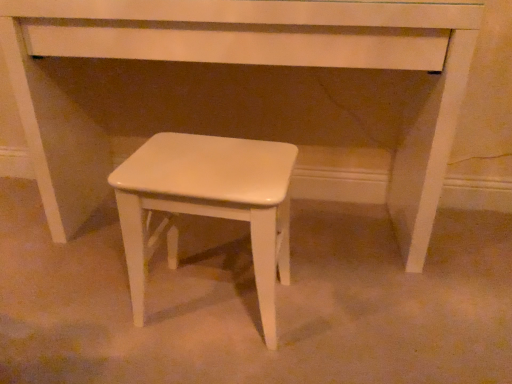
The width and height of the screenshot is (512, 384). Describe the element at coordinates (245, 93) in the screenshot. I see `white matte stool at center` at that location.

Image resolution: width=512 pixels, height=384 pixels. I want to click on white matte stool at center, so click(x=245, y=93).

Find the location of a particular element. Image resolution: width=512 pixels, height=384 pixels. white matte stool at center is located at coordinates (210, 202).

What do you see at coordinates (210, 202) in the screenshot? I see `white matte stool at center` at bounding box center [210, 202].

Where is `white matte stool at center`? The image size is (512, 384). white matte stool at center is located at coordinates (245, 93).

Does white matte stool at center appear on the right side of white matte stool at center?

Correct, you'll find white matte stool at center to the right of white matte stool at center.

Which object is further away from the camera, white matte stool at center or white matte stool at center?

white matte stool at center.

Does point (129, 105) come behind point (209, 152)?

That is True.

From the image's perspective, between white matte stool at center and white matte stool at center, which one is located above?

white matte stool at center is shown above in the image.

From a real-world perspective, is white matte stool at center over white matte stool at center?

Yes.

Does white matte stool at center have a lesser width compared to white matte stool at center?

No, white matte stool at center is not thinner than white matte stool at center.

Between white matte stool at center and white matte stool at center, which one has less height?

With less height is white matte stool at center.

Based on the photo, does white matte stool at center have a smaller size compared to white matte stool at center?

Actually, white matte stool at center might be larger than white matte stool at center.

Would you say white matte stool at center is inside or outside white matte stool at center?

white matte stool at center is not enclosed by white matte stool at center.

Is white matte stool at center in contact with white matte stool at center?

white matte stool at center and white matte stool at center are not in contact.

Is white matte stool at center turned away from white matte stool at center?

That's right, white matte stool at center is facing away from white matte stool at center.

How many degrees apart are the facing directions of white matte stool at center and white matte stool at center?

The angular difference between white matte stool at center and white matte stool at center is 0.178 degrees.

Identify the location of table located above the white matte stool at center (from a real-world perspective). (245, 93).

Can you confirm if white matte stool at center is positioned to the left of white matte stool at center?

Yes, white matte stool at center is to the left of white matte stool at center.

Considering the relative positions of white matte stool at center and white matte stool at center in the image provided, is white matte stool at center in front of white matte stool at center?

Yes, white matte stool at center is in front of white matte stool at center.

Between point (170, 156) and point (267, 137), which one is positioned in front?

Point (170, 156)

From the image's perspective, which object appears higher, white matte stool at center or white matte stool at center?

white matte stool at center, from the image's perspective.

From a real-world perspective, who is located lower, white matte stool at center or white matte stool at center?

In real-world perspective, white matte stool at center is lower.

Can you confirm if white matte stool at center is wider than white matte stool at center?

No.

Who is shorter, white matte stool at center or white matte stool at center?

white matte stool at center is shorter.

Is white matte stool at center bigger or smaller than white matte stool at center?

Considering their sizes, white matte stool at center takes up less space than white matte stool at center.

Would you say white matte stool at center is inside or outside white matte stool at center?

white matte stool at center is located beyond the bounds of white matte stool at center.

Is white matte stool at center beside white matte stool at center?

white matte stool at center and white matte stool at center are clearly separated.

Could you tell me if white matte stool at center is facing white matte stool at center?

No, white matte stool at center is not turned towards white matte stool at center.

You are a GUI agent. You are given a task and a screenshot of the screen. Output one action in this format:
    pyautogui.click(x=<x>, y=<y>)
    Task: Click on the table above the white matte stool at center (from a real-world perspective)
    The height and width of the screenshot is (384, 512).
    Given the screenshot: What is the action you would take?
    pyautogui.click(x=245, y=93)

I want to click on stool on the left of white matte stool at center, so click(x=210, y=202).

Where is `stool below the white matte stool at center (from the image's perspective)`? The width and height of the screenshot is (512, 384). stool below the white matte stool at center (from the image's perspective) is located at coordinates (210, 202).